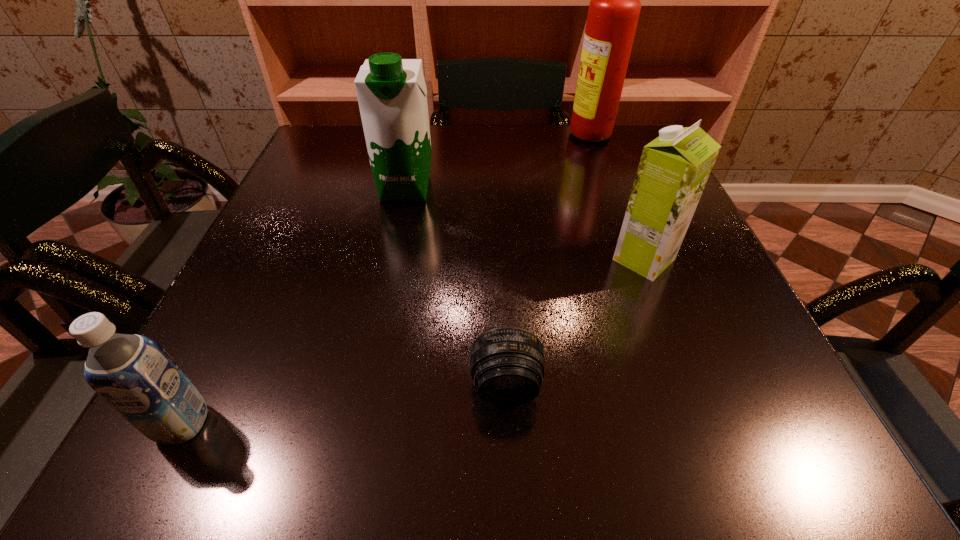
Find the location of a particular element. The width and height of the screenshot is (960, 540). fire extinguisher is located at coordinates (614, 9).

You are a GUI agent. You are given a task and a screenshot of the screen. Output one action in this format:
    pyautogui.click(x=<x>, y=<y>)
    Task: Click on the farthest object
    
    Given the screenshot: What is the action you would take?
    pyautogui.click(x=614, y=9)

Locate an element on the screen. The image size is (960, 540). the fourth nearest object is located at coordinates (392, 95).

Where is `the second soya milk from right to left`? the second soya milk from right to left is located at coordinates [392, 95].

The width and height of the screenshot is (960, 540). I want to click on the third farthest object, so (x=674, y=168).

In order to click on the second farthest soya milk in this screenshot , I will do `click(674, 168)`.

The image size is (960, 540). Identify the location of the shortest soya milk. (132, 373).

Find the location of a particular element. the nearest soya milk is located at coordinates (132, 373).

Locate an element on the screen. telephoto lens is located at coordinates point(507,364).

Identify the location of the shortest object. This screenshot has height=540, width=960. (507, 364).